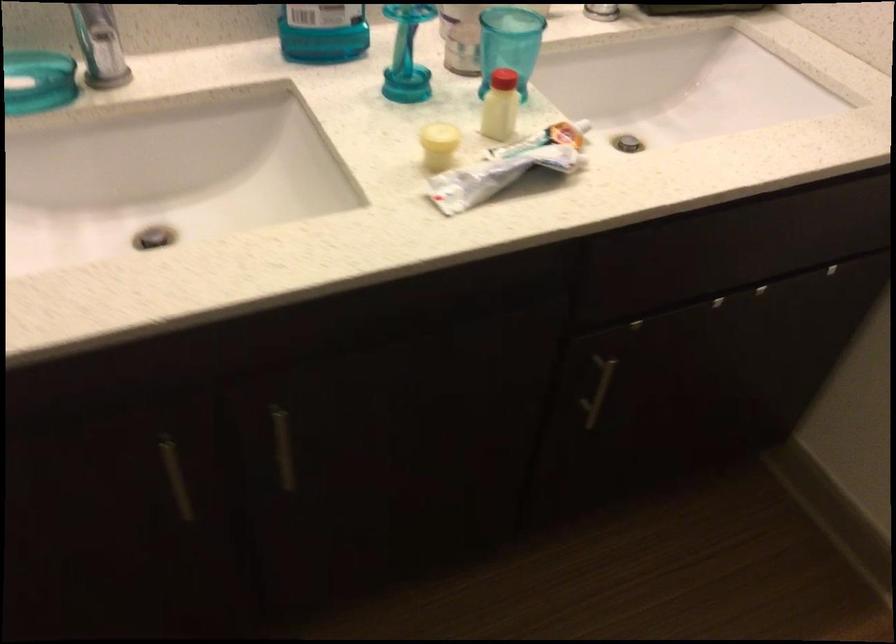
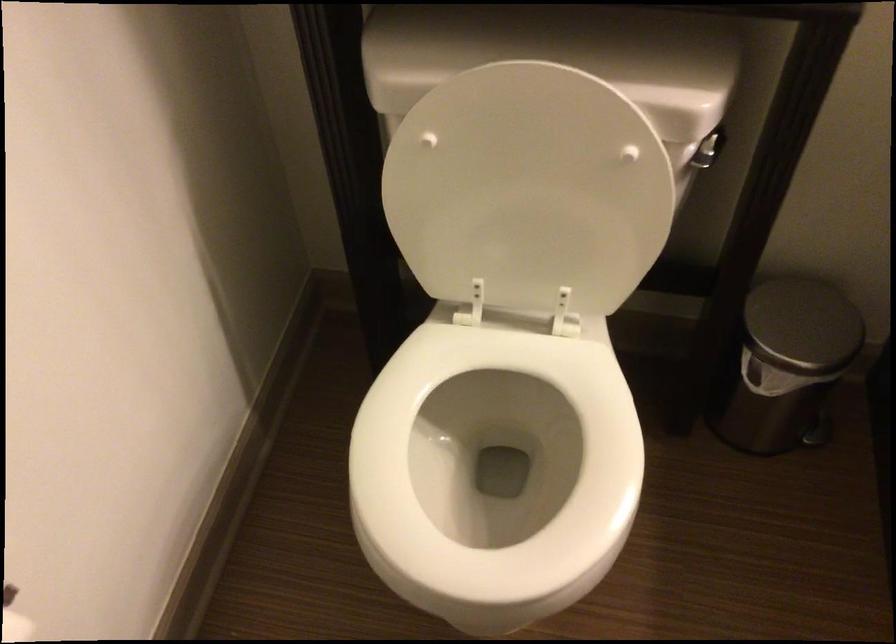
Question: The camera is either moving clockwise (left) or counter-clockwise (right) around the object. The first image is from the beginning of the video and the second image is from the end. Is the camera moving left or right when shooting the video?

Choices:
 (A) Left
 (B) Right

Answer: (B)